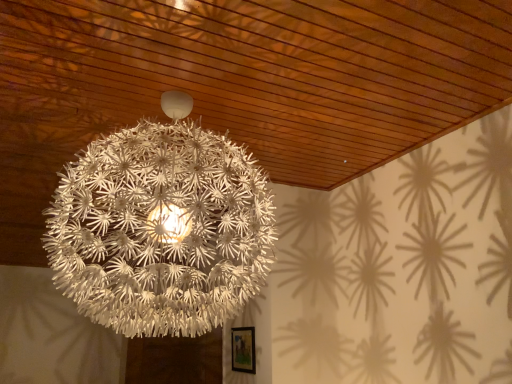
The image size is (512, 384). What do you see at coordinates (161, 228) in the screenshot?
I see `white matte spherical lamp at center` at bounding box center [161, 228].

Find the location of a particular element. white matte spherical lamp at center is located at coordinates (161, 228).

Measure the distance between point (232, 369) and camera.

3.14 meters.

The height and width of the screenshot is (384, 512). What do you see at coordinates (243, 349) in the screenshot?
I see `wooden framed picture at lower center` at bounding box center [243, 349].

Where is `wooden framed picture at lower center`? wooden framed picture at lower center is located at coordinates (243, 349).

In order to click on white matte spherical lamp at center in this screenshot , I will do `click(161, 228)`.

Considering the positions of objects wooden framed picture at lower center and white matte spherical lamp at center in the image provided, who is more to the left, wooden framed picture at lower center or white matte spherical lamp at center?

white matte spherical lamp at center is more to the left.

Which is behind, wooden framed picture at lower center or white matte spherical lamp at center?

wooden framed picture at lower center is further from the camera.

Which is more distant, (x=238, y=335) or (x=193, y=130)?

The point (x=238, y=335) is behind.

From the image's perspective, between wooden framed picture at lower center and white matte spherical lamp at center, who is located below?

wooden framed picture at lower center appears lower in the image.

From a real-world perspective, which is physically above, wooden framed picture at lower center or white matte spherical lamp at center?

In real-world perspective, white matte spherical lamp at center is above.

In terms of width, does wooden framed picture at lower center look wider or thinner when compared to white matte spherical lamp at center?

Clearly, wooden framed picture at lower center has less width compared to white matte spherical lamp at center.

Between wooden framed picture at lower center and white matte spherical lamp at center, which one has more height?

With more height is white matte spherical lamp at center.

Who is smaller, wooden framed picture at lower center or white matte spherical lamp at center?

Smaller between the two is wooden framed picture at lower center.

Based on the photo, is wooden framed picture at lower center positioned beyond the bounds of white matte spherical lamp at center?

wooden framed picture at lower center is positioned outside white matte spherical lamp at center.

Is wooden framed picture at lower center positioned far away from white matte spherical lamp at center?

Absolutely, wooden framed picture at lower center is distant from white matte spherical lamp at center.

Is wooden framed picture at lower center aimed at white matte spherical lamp at center?

No, wooden framed picture at lower center is not aimed at white matte spherical lamp at center.

The height and width of the screenshot is (384, 512). What are the coordinates of `lamp above the wooden framed picture at lower center (from a real-world perspective)` in the screenshot? It's located at (161, 228).

Which is more to the right, white matte spherical lamp at center or wooden framed picture at lower center?

From the viewer's perspective, wooden framed picture at lower center appears more on the right side.

Which is in front, white matte spherical lamp at center or wooden framed picture at lower center?

white matte spherical lamp at center is in front.

Is point (205, 156) less distant than point (232, 336)?

Yes, it is in front of point (232, 336).

Looking at this image, from the image's perspective, is white matte spherical lamp at center below wooden framed picture at lower center?

No, from the image's perspective, white matte spherical lamp at center is not beneath wooden framed picture at lower center.

From a real-world perspective, is white matte spherical lamp at center positioned over wooden framed picture at lower center based on gravity?

Correct, in the physical world, white matte spherical lamp at center is higher than wooden framed picture at lower center.

Which of these two, white matte spherical lamp at center or wooden framed picture at lower center, is thinner?

Thinner between the two is wooden framed picture at lower center.

Who is shorter, white matte spherical lamp at center or wooden framed picture at lower center?

wooden framed picture at lower center is shorter.

Which of these two, white matte spherical lamp at center or wooden framed picture at lower center, is smaller?

wooden framed picture at lower center is smaller.

Could wooden framed picture at lower center be considered to be inside white matte spherical lamp at center?

No.

Are white matte spherical lamp at center and wooden framed picture at lower center located far from each other?

white matte spherical lamp at center is far away from wooden framed picture at lower center.

Consider the image. Is white matte spherical lamp at center facing towards wooden framed picture at lower center?

No, white matte spherical lamp at center does not turn towards wooden framed picture at lower center.

You are a GUI agent. You are given a task and a screenshot of the screen. Output one action in this format:
    pyautogui.click(x=<x>, y=<y>)
    Task: Click on the picture frame on the right of the white matte spherical lamp at center
    This screenshot has width=512, height=384.
    Given the screenshot: What is the action you would take?
    pyautogui.click(x=243, y=349)

Find the location of a particular element. Image resolution: width=512 pixels, height=384 pixels. lamp above the wooden framed picture at lower center (from the image's perspective) is located at coordinates (161, 228).

This screenshot has width=512, height=384. Find the location of `picture frame behind the white matte spherical lamp at center`. picture frame behind the white matte spherical lamp at center is located at coordinates (243, 349).